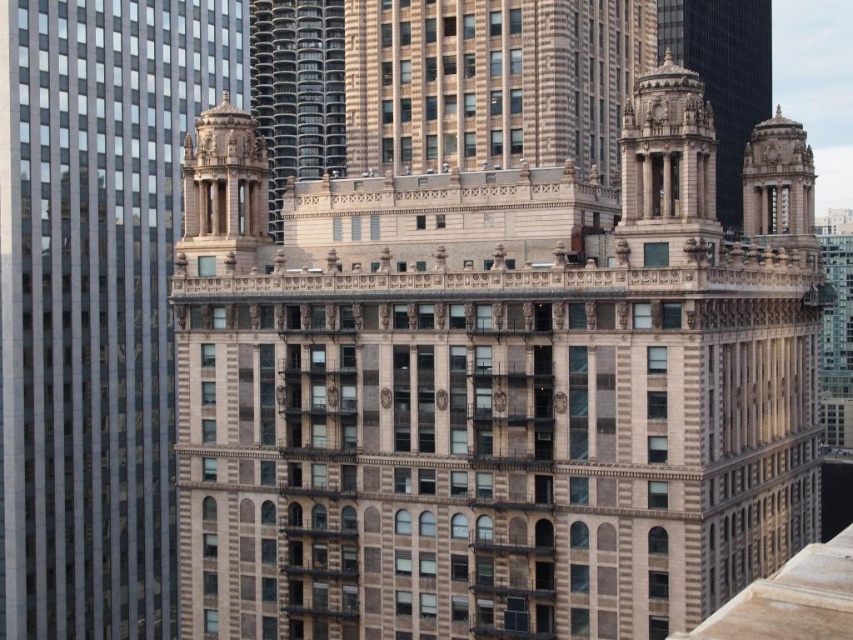
Question: Considering the relative positions of brown stone building at center and beige stone tower at center in the image provided, where is brown stone building at center located with respect to beige stone tower at center?

Choices:
 (A) below
 (B) above

Answer: (A)

Question: Can you confirm if brown stone building at center is bigger than beige stone tower at center?

Choices:
 (A) no
 (B) yes

Answer: (B)

Question: Which object is closer to the camera taking this photo?

Choices:
 (A) brown stone building at center
 (B) beige stone tower at center

Answer: (A)

Question: Is brown stone building at center positioned before beige stone tower at center?

Choices:
 (A) no
 (B) yes

Answer: (B)